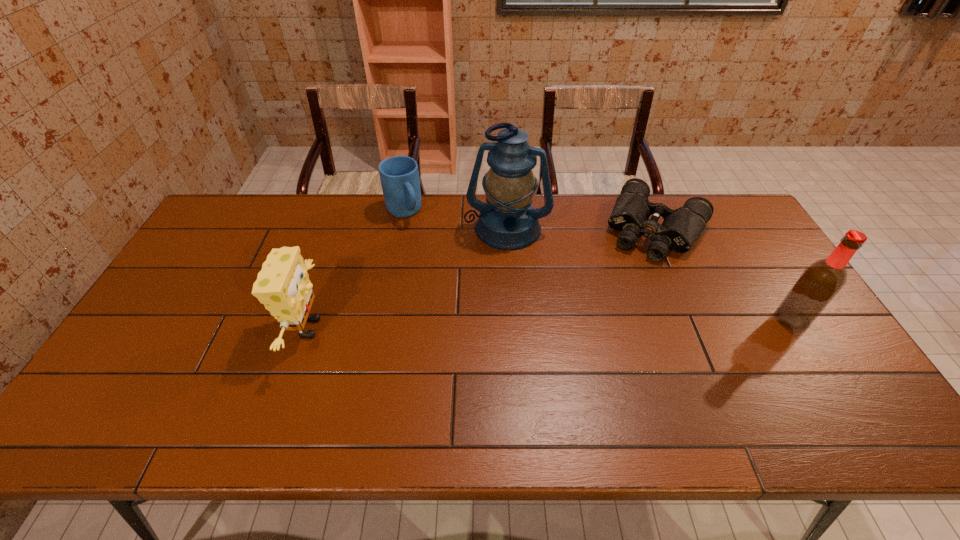
Locate which object is the third closest to the third object from left to right. Please provide its 2D coordinates. Your answer should be formatted as a tuple, i.e. [(x, y)], where the tuple contains the x and y coordinates of a point satisfying the conditions above.

[(283, 286)]

Locate which object ranks third in proximity to the second tallest object. Please provide its 2D coordinates. Your answer should be formatted as a tuple, i.e. [(x, y)], where the tuple contains the x and y coordinates of a point satisfying the conditions above.

[(399, 175)]

The width and height of the screenshot is (960, 540). I want to click on vacant space that satisfies the following two spatial constraints: 1. on the back side of the binoculars; 2. on the right side of the tallest object, so click(507, 228).